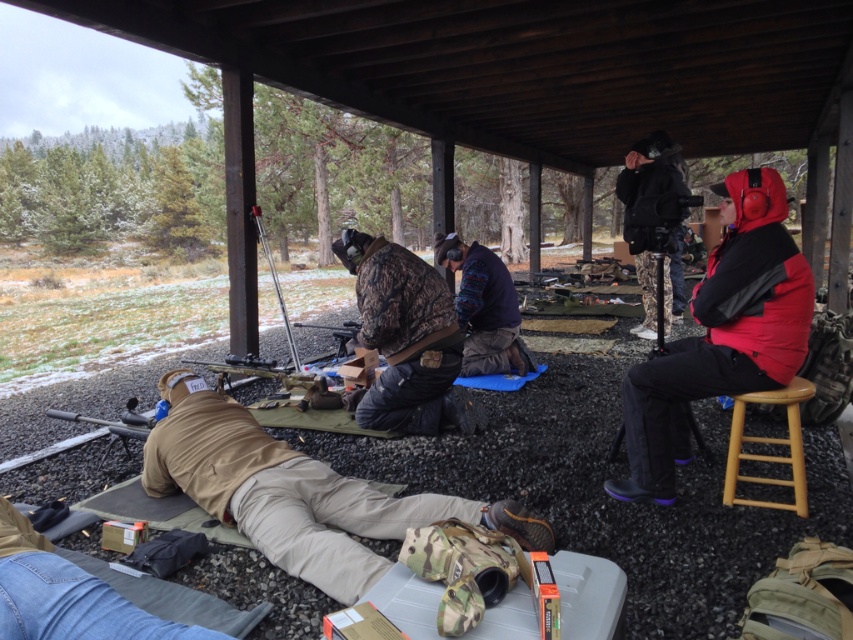
Question: Can you confirm if light brown wooden stool at right is positioned below metallic silver rifle at center?

Choices:
 (A) no
 (B) yes

Answer: (B)

Question: Is red fleece jacket at right positioned behind black matte jacket at upper right?

Choices:
 (A) no
 (B) yes

Answer: (A)

Question: Which of the following is the closest to the observer?

Choices:
 (A) (529, 528)
 (B) (451, 256)
 (C) (724, 385)
 (D) (425, 285)

Answer: (A)

Question: Among these objects, which one is nearest to the camera?

Choices:
 (A) tan fabric pants at lower left
 (B) knitted sweater at center
 (C) black matte jacket at upper right

Answer: (A)

Question: Can you confirm if tan fabric pants at lower left is wider than metallic silver rifle at center?

Choices:
 (A) yes
 (B) no

Answer: (A)

Question: Which point is farther to the camera?

Choices:
 (A) tan fabric pants at lower left
 (B) red fleece jacket at right
 (C) black matte jacket at upper right
 (D) light brown wooden stool at right

Answer: (C)